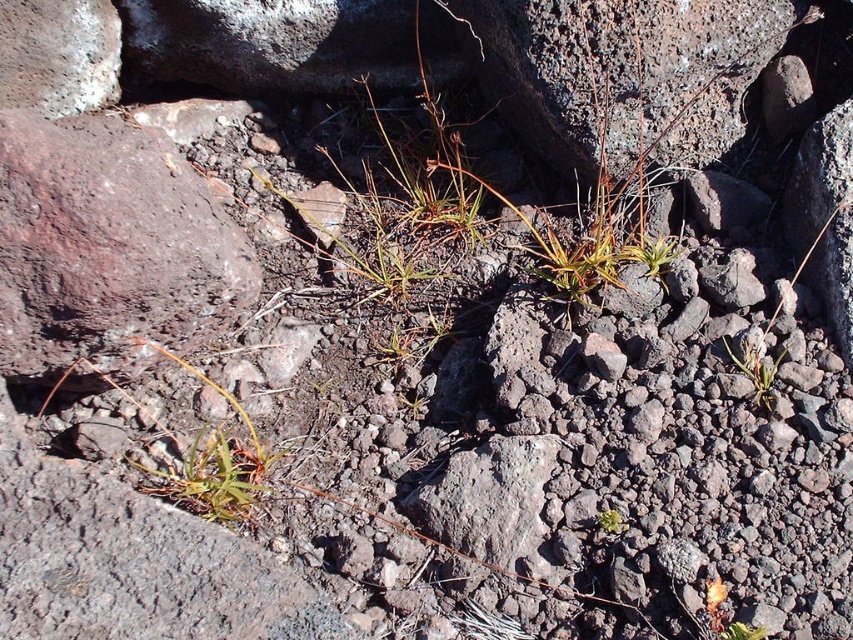
You are a hiker who needs to cross this rocky terrain. You notice the green grass at center and the green leafy plant at center. Which one is taller?

The green grass at center is much taller than the green leafy plant at center.

You are a hiker navigating the rocky terrain and want to move from the point at coordinates point (770, 371) to the point at coordinates point (605, 509). Which direction should you move relative to your current position?

To move from point (770, 371) to point (605, 509), you should move towards the lower right direction since point (605, 509) is closer to the viewer compared to point (770, 371).